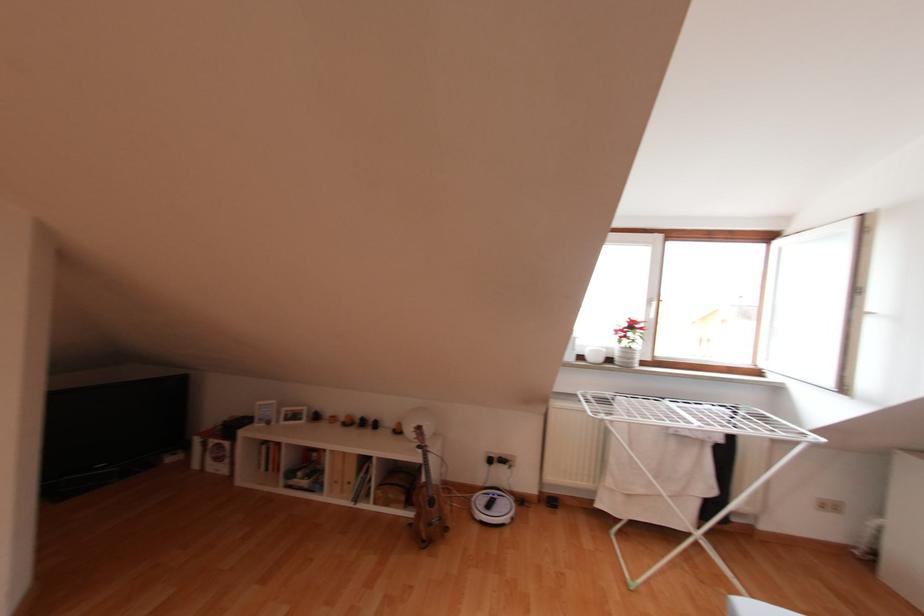
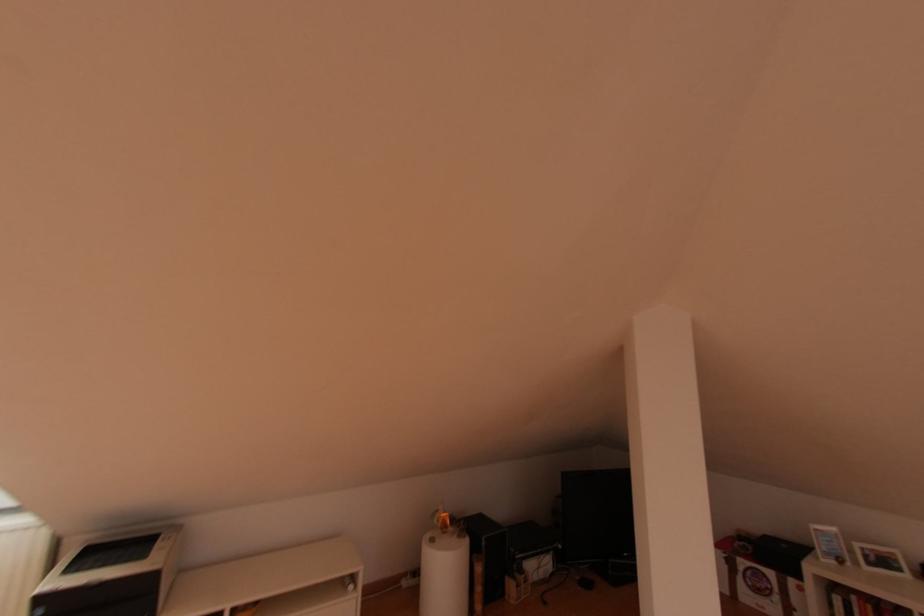
Find the pixel in the second image that matches point (226, 445) in the first image.

(771, 573)